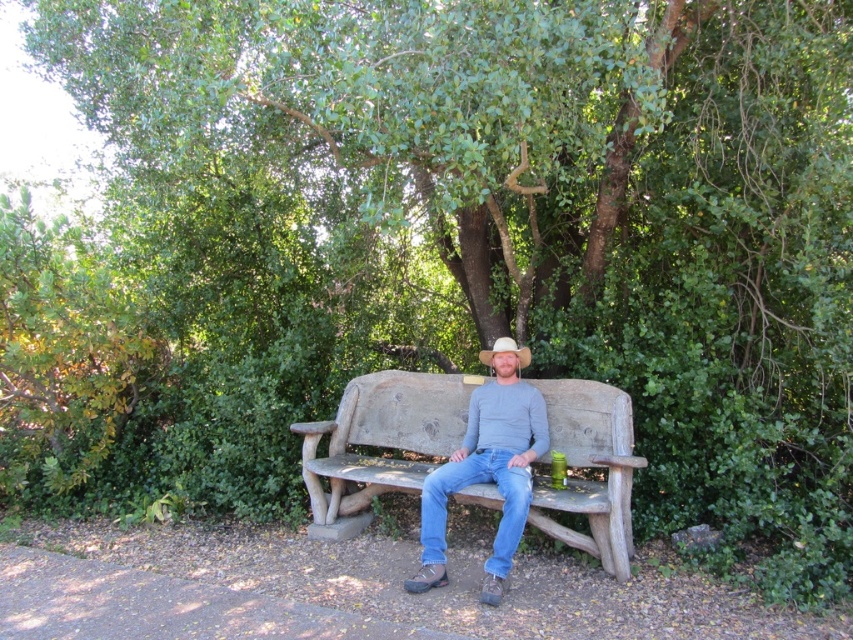
You are a photographer standing at the bottom left corner of the scene. You want to capture a photo where the rustic wood bench at center is in focus while the matte gray shirt at center is slightly blurred in the background. Is this possible based on their positions?

The rustic wood bench at center is located above the matte gray shirt at center. Since the bench is above the shirt, adjusting the camera focus to the bench could blur the shirt in the background, making it possible to achieve the desired effect.

You are standing in the outdoor setting and want to place a small decorative rock between the two points, point (381, 477) and point (519, 356). Which point should the rock be closer to in order to be nearer to the viewer?

The rock should be closer to point (381, 477) because it is nearer to the viewer compared to point (519, 356).